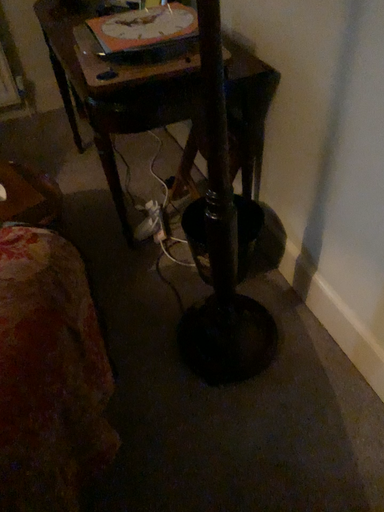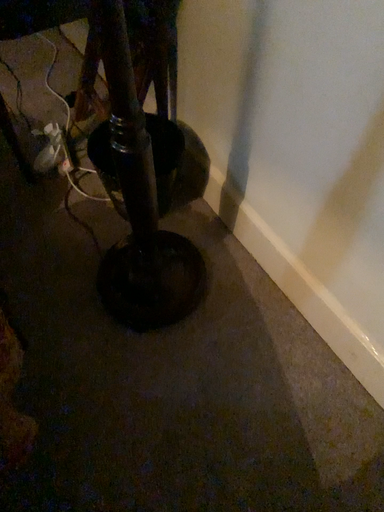
Question: How did the camera likely rotate when shooting the video?

Choices:
 (A) rotated upward
 (B) rotated downward

Answer: (B)